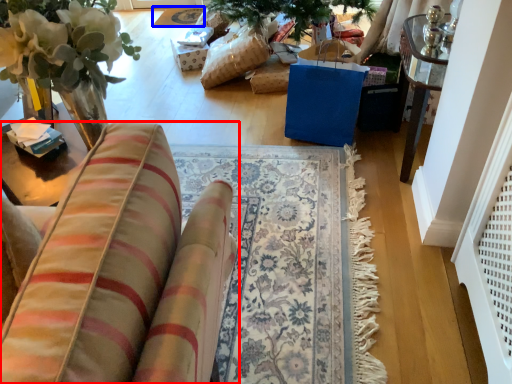
Question: Which of the following is the farthest to the observer, furniture (highlighted by a red box) or mat (highlighted by a blue box)?

Choices:
 (A) furniture
 (B) mat

Answer: (B)